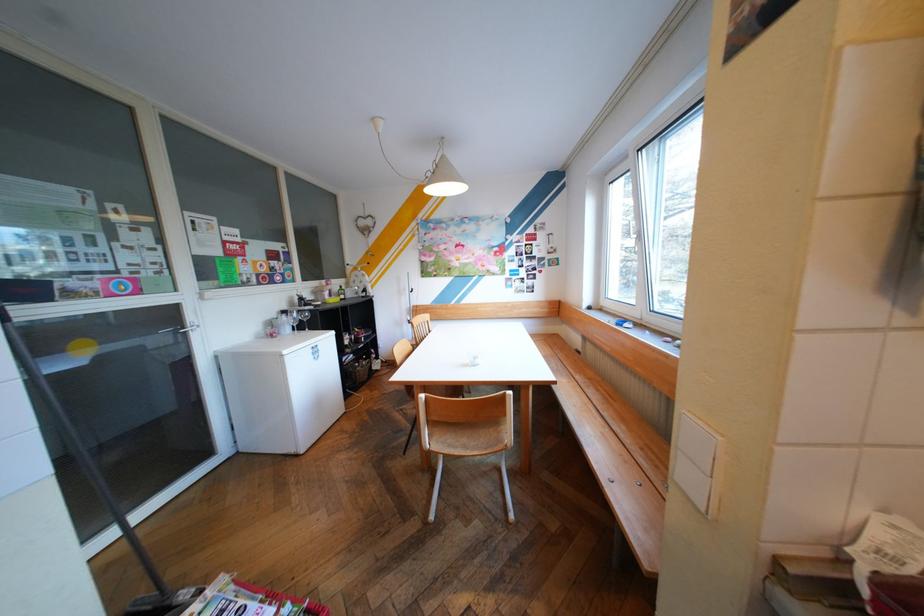
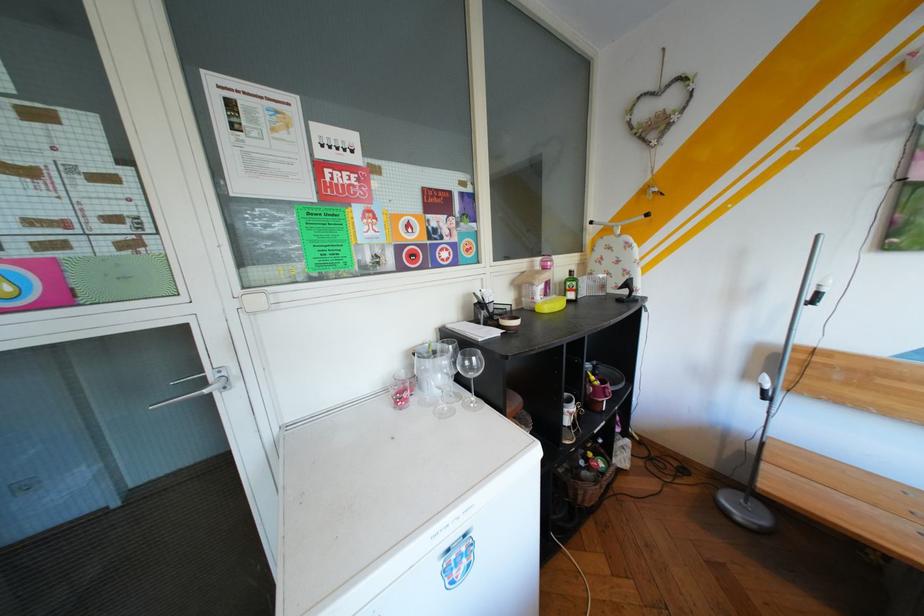
The point at (335, 291) is marked in the first image. Where is the corresponding point in the second image?

(545, 284)